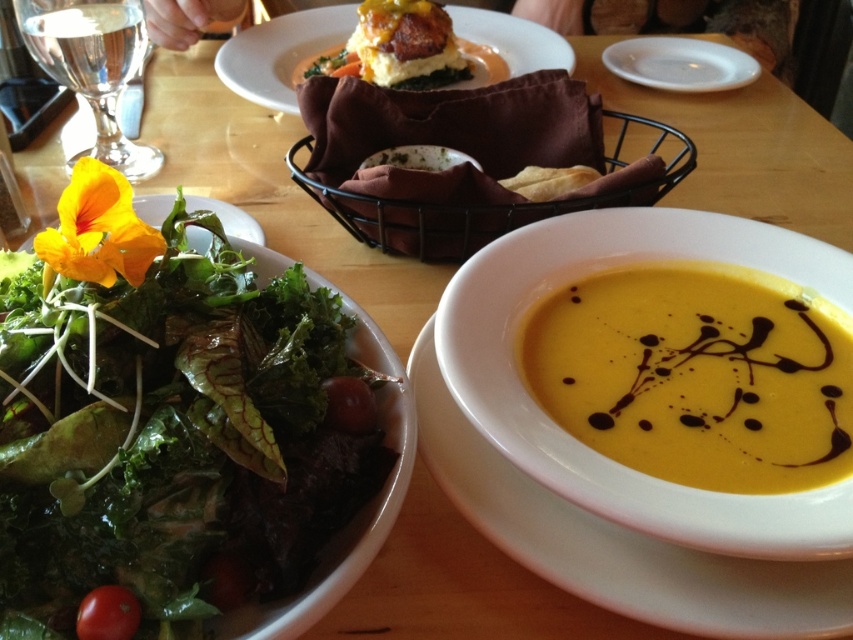
Which of these two, green leafymaterial/textureobject at left or white ceramic plate at upper right, stands taller?

Standing taller between the two is green leafymaterial/textureobject at left.

Looking at this image, does green leafymaterial/textureobject at left have a larger size compared to white ceramic plate at upper right?

Yes, green leafymaterial/textureobject at left is bigger than white ceramic plate at upper right.

At what (x,y) coordinates should I click in order to perform the action: click on green leafymaterial/textureobject at left. Please return your answer as a coordinate pair (x, y). This screenshot has width=853, height=640. Looking at the image, I should click on (177, 424).

Can you confirm if yellow creamy soup at center is smaller than red smooth tomato at lower left?

Incorrect, yellow creamy soup at center is not smaller in size than red smooth tomato at lower left.

Which of these two, yellow creamy soup at center or red smooth tomato at lower left, stands shorter?

Standing shorter between the two is red smooth tomato at lower left.

Is point (750, 308) positioned behind point (129, 608)?

Yes, it is.

Find the location of a particular element. Image resolution: width=853 pixels, height=640 pixels. yellow creamy soup at center is located at coordinates (697, 376).

Which is above, matte brown plate at upper center or red smooth tomato at lower left?

Positioned higher is matte brown plate at upper center.

Describe the element at coordinates (279, 52) in the screenshot. The width and height of the screenshot is (853, 640). I see `matte brown plate at upper center` at that location.

Find the location of `matte brown plate at upper center`. matte brown plate at upper center is located at coordinates (279, 52).

The image size is (853, 640). What are the coordinates of `matte brown plate at upper center` in the screenshot? It's located at (279, 52).